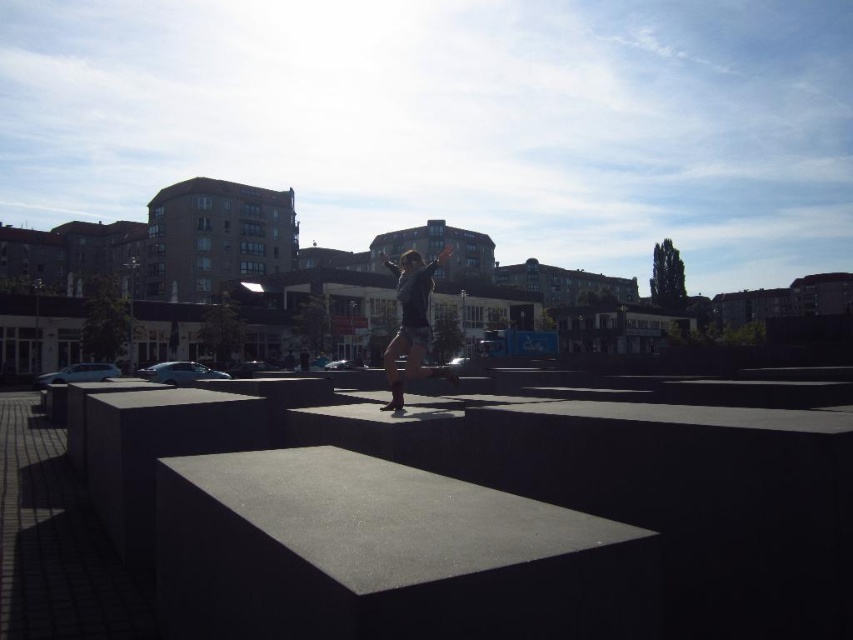
Question: Is smooth concrete ledge at center to the left of matte black skateboarder at center from the viewer's perspective?

Choices:
 (A) yes
 (B) no

Answer: (A)

Question: Among these objects, which one is nearest to the camera?

Choices:
 (A) matte black skateboarder at center
 (B) smooth concrete ledge at center

Answer: (B)

Question: Where is smooth concrete ledge at center located in relation to matte black skateboarder at center in the image?

Choices:
 (A) below
 (B) above

Answer: (A)

Question: Which point is closer to the camera taking this photo?

Choices:
 (A) (624, 440)
 (B) (399, 282)

Answer: (A)

Question: Is smooth concrete ledge at center above matte black skateboarder at center?

Choices:
 (A) no
 (B) yes

Answer: (A)